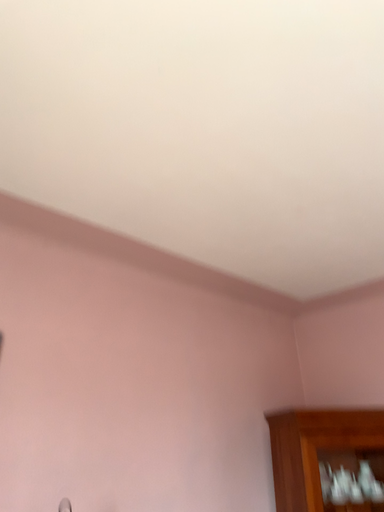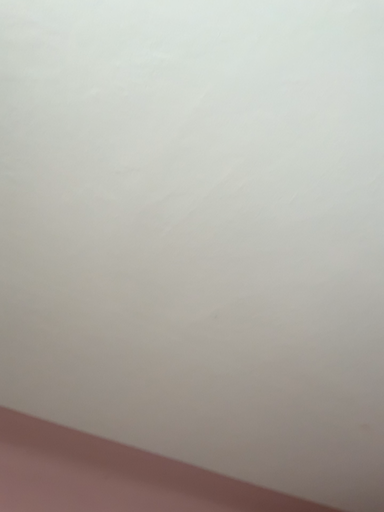
Question: Which way did the camera rotate in the video?

Choices:
 (A) rotated right
 (B) rotated left

Answer: (B)